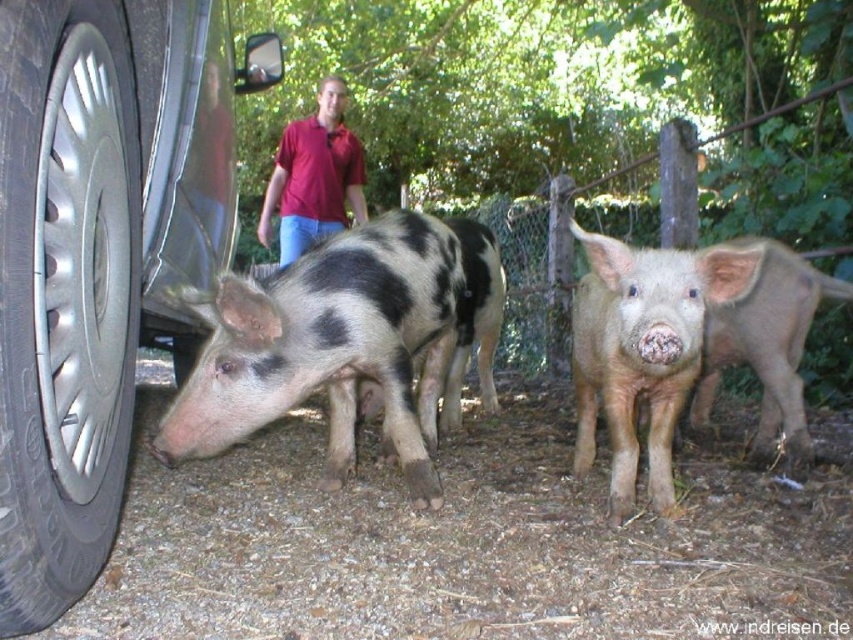
You are standing in the rural outdoor scene described. You see the light brown furry piglet at center and the light brown fur piglet at center. Which piglet is closer to you?

The light brown furry piglet at center is closer to the viewer than the light brown fur piglet at center.

You are standing in a rural outdoor area and see the light brown fur piglet at center and the matte red shirt at center. Which object is nearer to you?

The light brown fur piglet at center is closer to the viewer than the matte red shirt at center.

You are standing in the rural outdoor scene described. You see the brushed metal tire at lower left and the matte red shirt at center. Which object is positioned to the right of the other?

The brushed metal tire at lower left is to the right of the matte red shirt at center.